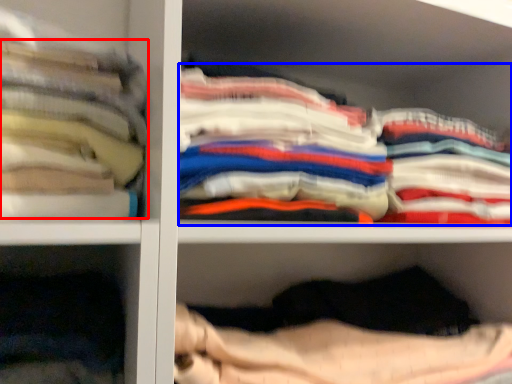
Question: Which object appears farthest to the camera in this image, clothing (highlighted by a red box) or clothing (highlighted by a blue box)?

Choices:
 (A) clothing
 (B) clothing

Answer: (B)